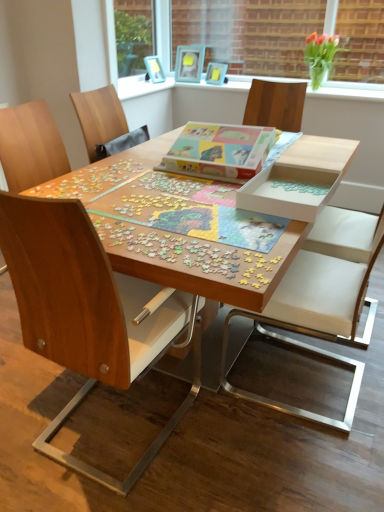
Question: Is the depth of wooden photo frame at upper center, the 2th picture frame in the left-to-right sequence, greater than that of white leather chair at center, which is the 2th chair in left-to-right order?

Choices:
 (A) no
 (B) yes

Answer: (B)

Question: Could you tell me if wooden photo frame at upper center, the second picture frame viewed from the right, is facing white leather chair at center, which is the 2th chair in left-to-right order?

Choices:
 (A) no
 (B) yes

Answer: (A)

Question: Can you confirm if wooden photo frame at upper center, the second picture frame viewed from the right, is thinner than white leather chair at center, marked as the first chair in a right-to-left arrangement?

Choices:
 (A) no
 (B) yes

Answer: (B)

Question: From a real-world perspective, is wooden photo frame at upper center, the 2th picture frame in the left-to-right sequence, on top of white leather chair at center, marked as the first chair in a right-to-left arrangement?

Choices:
 (A) yes
 (B) no

Answer: (A)

Question: Is wooden photo frame at upper center, the 2th picture frame in the left-to-right sequence, positioned before white leather chair at center, which is the 2th chair in left-to-right order?

Choices:
 (A) yes
 (B) no

Answer: (B)

Question: Considering the positions of multicolored cardboard jigsaw puzzle at center, the 2th jigsaw puzzle in the bottom-to-top sequence, and wooden chair at left, positioned as the first chair in left-to-right order, in the image, is multicolored cardboard jigsaw puzzle at center, the 2th jigsaw puzzle in the bottom-to-top sequence, taller or shorter than wooden chair at left, positioned as the first chair in left-to-right order,?

Choices:
 (A) short
 (B) tall

Answer: (A)

Question: From a real-world perspective, is multicolored cardboard jigsaw puzzle at center, the 1th jigsaw puzzle in the top-to-bottom sequence, positioned above or below wooden chair at left, the second chair from the right?

Choices:
 (A) below
 (B) above

Answer: (B)

Question: In the image, is multicolored cardboard jigsaw puzzle at center, the 1th jigsaw puzzle in the top-to-bottom sequence, positioned in front of or behind wooden chair at left, positioned as the first chair in left-to-right order?

Choices:
 (A) behind
 (B) front

Answer: (A)

Question: From the image's perspective, is multicolored cardboard jigsaw puzzle at center, the 2th jigsaw puzzle in the bottom-to-top sequence, located above or below wooden chair at left, the second chair from the right?

Choices:
 (A) below
 (B) above

Answer: (B)

Question: Do you think green glass vase at upper right is within clear glass vase at upper center, or outside of it?

Choices:
 (A) inside
 (B) outside

Answer: (B)

Question: Is point (314, 49) closer or farther from the camera than point (357, 84)?

Choices:
 (A) closer
 (B) farther

Answer: (A)

Question: In terms of height, does green glass vase at upper right look taller or shorter compared to clear glass vase at upper center?

Choices:
 (A) tall
 (B) short

Answer: (B)

Question: Based on their sizes in the image, would you say green glass vase at upper right is bigger or smaller than clear glass vase at upper center?

Choices:
 (A) big
 (B) small

Answer: (B)

Question: Choose the correct answer: Is matte plastic picture frame at upper center, the third picture frame positioned from the left, inside wooden puzzle pieces at center, the first jigsaw puzzle ordered from the bottom, or outside it?

Choices:
 (A) outside
 (B) inside

Answer: (A)

Question: Does point (223, 68) appear closer or farther from the camera than point (137, 217)?

Choices:
 (A) farther
 (B) closer

Answer: (A)